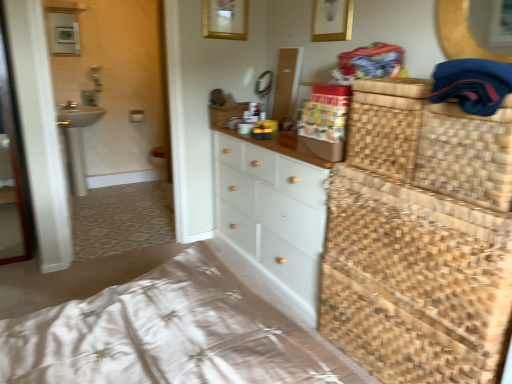
This screenshot has width=512, height=384. Identify the location of white painted wood chest of drawers at center. (272, 213).

Image resolution: width=512 pixels, height=384 pixels. What do you see at coordinates (159, 324) in the screenshot?
I see `woven wood bed frame at lower right` at bounding box center [159, 324].

The image size is (512, 384). In order to click on woven natural basket at right in this screenshot , I will do `click(419, 238)`.

The height and width of the screenshot is (384, 512). Identify the location of white painted wood chest of drawers at center. (272, 213).

Considering the sizes of objects matte white medicine cabinet at upper left and dark blue fabric at upper right in the image provided, who is smaller, matte white medicine cabinet at upper left or dark blue fabric at upper right?

Smaller between the two is matte white medicine cabinet at upper left.

From a real-world perspective, is matte white medicine cabinet at upper left under dark blue fabric at upper right?

Actually, matte white medicine cabinet at upper left is physically above dark blue fabric at upper right in the real world.

Can you see matte white medicine cabinet at upper left touching dark blue fabric at upper right?

No, matte white medicine cabinet at upper left is not touching dark blue fabric at upper right.

Between point (53, 53) and point (473, 114), which one is positioned in front?

Positioned in front is point (473, 114).

Between dark blue fabric at upper right and woven brown basket at right, placed as the second basket when sorted from left to right, which one has smaller size?

Smaller between the two is dark blue fabric at upper right.

Is dark blue fabric at upper right next to woven brown basket at right, positioned as the first basket in bottom-to-top order?

There is a gap between dark blue fabric at upper right and woven brown basket at right, positioned as the first basket in bottom-to-top order.

Is dark blue fabric at upper right not within woven brown basket at right, positioned as the first basket in front-to-back order?

Actually, dark blue fabric at upper right is at least partially inside woven brown basket at right, positioned as the first basket in front-to-back order.

Based on the photo, how distant is dark blue fabric at upper right from woven brown basket at right, positioned as the 2th basket in top-to-bottom order?

They are 13.04 centimeters apart.

Which object is thinner, dark blue fabric at upper right or white painted wood chest of drawers at center?

dark blue fabric at upper right is thinner.

Is point (445, 96) behind point (244, 192)?

No, (445, 96) is in front of (244, 192).

Is dark blue fabric at upper right aimed at white painted wood chest of drawers at center?

No, dark blue fabric at upper right does not turn towards white painted wood chest of drawers at center.

Between dark blue fabric at upper right and white painted wood chest of drawers at center, which one appears on the right side from the viewer's perspective?

dark blue fabric at upper right.

Can you confirm if gold metallic picture frame at upper center is smaller than woven wood bed frame at lower right?

Correct, gold metallic picture frame at upper center occupies less space than woven wood bed frame at lower right.

Considering the relative positions of gold metallic picture frame at upper center and woven wood bed frame at lower right in the image provided, is gold metallic picture frame at upper center to the left or to the right of woven wood bed frame at lower right?

gold metallic picture frame at upper center is to the right of woven wood bed frame at lower right.

Is transparent glass screen door at left not inside white painted wood chest of drawers at center?

transparent glass screen door at left lies outside white painted wood chest of drawers at center's area.

Who is smaller, transparent glass screen door at left or white painted wood chest of drawers at center?

With smaller size is transparent glass screen door at left.

Looking at their sizes, would you say transparent glass screen door at left is wider or thinner than white painted wood chest of drawers at center?

In the image, transparent glass screen door at left appears to be more narrow than white painted wood chest of drawers at center.

Considering the positions of objects transparent glass screen door at left and white painted wood chest of drawers at center in the image provided, who is more to the left, transparent glass screen door at left or white painted wood chest of drawers at center?

From the viewer's perspective, transparent glass screen door at left appears more on the left side.

Does white ceramic sink at left have a greater height compared to woven wood bed frame at lower right?

Correct, white ceramic sink at left is much taller as woven wood bed frame at lower right.

From a real-world perspective, is white ceramic sink at left beneath woven wood bed frame at lower right?

Yes, from a real-world perspective, white ceramic sink at left is under woven wood bed frame at lower right.

Does white ceramic sink at left turn towards woven wood bed frame at lower right?

Yes, white ceramic sink at left is turned towards woven wood bed frame at lower right.

From the picture: Is white ceramic sink at left far away from woven wood bed frame at lower right?

white ceramic sink at left is far away from woven wood bed frame at lower right.

How many degrees apart are the facing directions of woven brown basket at right, placed as the second basket when sorted from left to right, and woven natural basket at right?

0.677 degrees separate the facing orientations of woven brown basket at right, placed as the second basket when sorted from left to right, and woven natural basket at right.

Considering the sizes of objects woven brown basket at right, positioned as the first basket in right-to-left order, and woven natural basket at right in the image provided, who is shorter, woven brown basket at right, positioned as the first basket in right-to-left order, or woven natural basket at right?

With less height is woven brown basket at right, positioned as the first basket in right-to-left order.

Which of these two, woven brown basket at right, positioned as the 2th basket in top-to-bottom order, or woven natural basket at right, is bigger?

woven natural basket at right.

Find the location of a particular element. The width and height of the screenshot is (512, 384). dresser behind the woven brown basket at right, positioned as the first basket in front-to-back order is located at coordinates (419, 238).

Find the location of a particular element. clothing lying on the right of matte white medicine cabinet at upper left is located at coordinates (472, 84).

Where is `clothing that appears in front of the woven brown basket at right, positioned as the first basket in bottom-to-top order`? The height and width of the screenshot is (384, 512). clothing that appears in front of the woven brown basket at right, positioned as the first basket in bottom-to-top order is located at coordinates (472, 84).

From the image, which object appears to be farther from gold metallic picture frame at upper center, dark blue fabric at upper right or woven natural basket at right?

The object further to gold metallic picture frame at upper center is dark blue fabric at upper right.

From the picture: Which object lies nearer to the anchor point woven brown basket at right, the 2th basket positioned from the back, white painted wood chest of drawers at center or woven natural basket at right?

woven natural basket at right is positioned closer to the anchor woven brown basket at right, the 2th basket positioned from the back.

When comparing their distances from matte white medicine cabinet at upper left, does white ceramic sink at left or woven wood bed frame at lower right seem closer?

The object closer to matte white medicine cabinet at upper left is white ceramic sink at left.

When comparing their distances from woven brown basket at right, positioned as the first basket in bottom-to-top order, does white ceramic sink at left or matte white medicine cabinet at upper left seem closer?

Based on the image, white ceramic sink at left appears to be nearer to woven brown basket at right, positioned as the first basket in bottom-to-top order.

From the image, which object appears to be farther from dark blue fabric at upper right, transparent glass screen door at left or gold metallic picture frame at upper center?

Among the two, transparent glass screen door at left is located further to dark blue fabric at upper right.

Looking at the image, which one is located closer to woven wood bed frame at lower right, matte white medicine cabinet at upper left or woven natural basket at right?

Among the two, woven natural basket at right is located nearer to woven wood bed frame at lower right.

Considering their positions, is gold metallic picture frame at upper center positioned closer to matte white medicine cabinet at upper left than woven straw basket at center, which is counted as the second basket, starting from the front?

gold metallic picture frame at upper center is closer to matte white medicine cabinet at upper left.

Estimate the real-world distances between objects in this image. Which object is closer to transparent glass screen door at left, white painted wood chest of drawers at center or woven straw basket at center, the 1th basket viewed from the left?

woven straw basket at center, the 1th basket viewed from the left, is closer to transparent glass screen door at left.

Locate an element on the screen. dresser positioned between dark blue fabric at upper right and gold metallic picture frame at upper center from near to far is located at coordinates (419, 238).

In order to click on basket positioned between woven brown basket at right, positioned as the 2th basket in top-to-bottom order, and white ceramic sink at left from near to far in this screenshot , I will do `click(226, 114)`.

Locate an element on the screen. The height and width of the screenshot is (384, 512). picture frame between woven brown basket at right, positioned as the first basket in front-to-back order, and matte white medicine cabinet at upper left from front to back is located at coordinates (225, 19).

You are a GUI agent. You are given a task and a screenshot of the screen. Output one action in this format:
    pyautogui.click(x=<x>, y=<y>)
    Task: Click on the screen door between white ceramic sink at left and woven natural basket at right from left to right
    Image resolution: width=512 pixels, height=384 pixels.
    Given the screenshot: What is the action you would take?
    pyautogui.click(x=13, y=155)